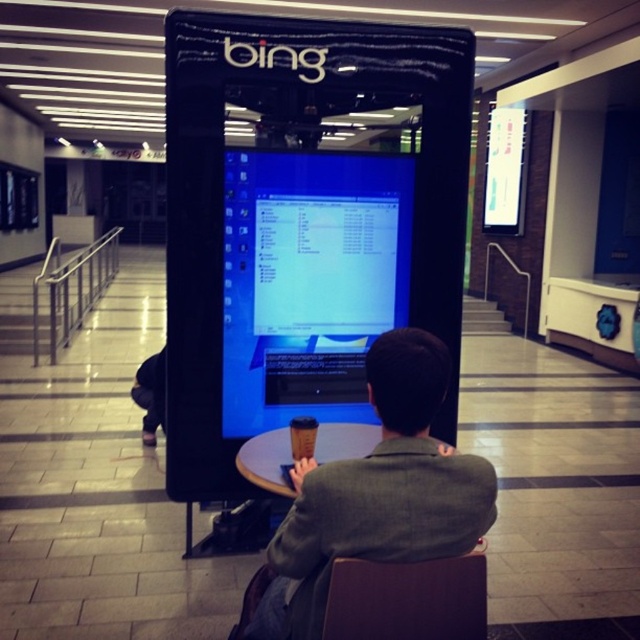
Question: Which point is farther to the camera?

Choices:
 (A) brown leather chair at lower center
 (B) blue glossy monitor at center

Answer: (B)

Question: Where is blue glossy monitor at center located in relation to dark gray suit at center in the image?

Choices:
 (A) right
 (B) left

Answer: (B)

Question: Does blue glossy monitor at center have a larger size compared to dark gray suit at center?

Choices:
 (A) yes
 (B) no

Answer: (B)

Question: Which object is the farthest from the brown leather chair at lower center?

Choices:
 (A) blue glossy monitor at center
 (B) dark gray suit at center

Answer: (A)

Question: Which is farther from the blue glossy monitor at center?

Choices:
 (A) brown leather chair at lower center
 (B) dark gray suit at center

Answer: (A)

Question: Can you confirm if dark gray suit at center is thinner than brown leather chair at lower center?

Choices:
 (A) yes
 (B) no

Answer: (B)